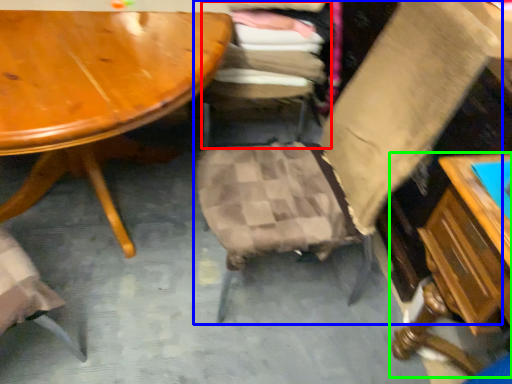
Question: Estimate the real-world distances between objects in this image. Which object is farther from chair (highlighted by a red box), chair (highlighted by a blue box) or table (highlighted by a green box)?

Choices:
 (A) chair
 (B) table

Answer: (B)